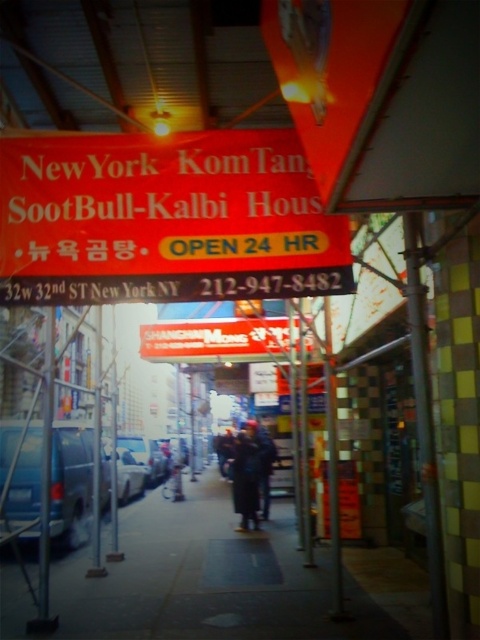
Question: Is blue matte van at center above white matte sign at center?

Choices:
 (A) no
 (B) yes

Answer: (A)

Question: Can you confirm if blue matte van at center is positioned to the right of white matte sign at center?

Choices:
 (A) no
 (B) yes

Answer: (A)

Question: Which of the following is the farthest from the observer?

Choices:
 (A) (68, 531)
 (B) (130, 451)

Answer: (B)

Question: Observing the image, what is the correct spatial positioning of smooth concrete sidewalk at center in reference to white matte sign at center?

Choices:
 (A) right
 (B) left

Answer: (B)

Question: Which of the following is the closest to the observer?

Choices:
 (A) white matte sign at center
 (B) silver metallic car at center

Answer: (A)

Question: Estimate the real-world distances between objects in this image. Which object is closer to the red plastic sign at center?

Choices:
 (A) dark blue coat at center
 (B) metallic silver car at center
 (C) silver metallic car at center

Answer: (A)